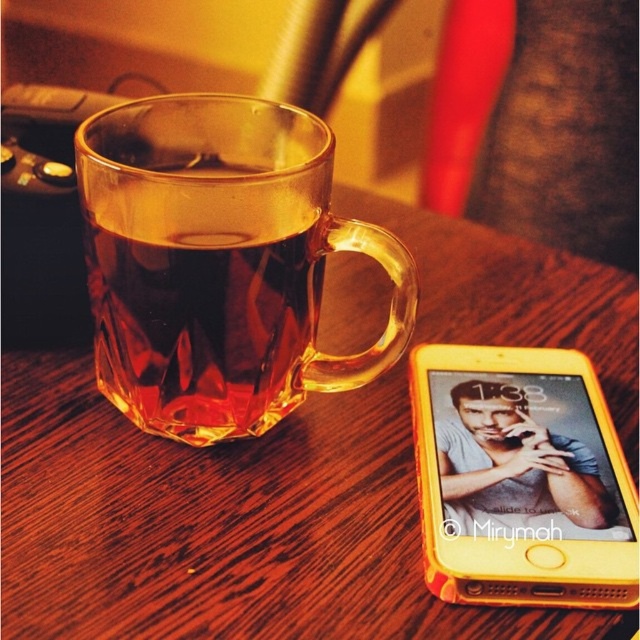
Question: Which point is closer to the camera taking this photo?

Choices:
 (A) (566, 426)
 (B) (150, 285)

Answer: (B)

Question: Which point is farther to the camera?

Choices:
 (A) (424, 352)
 (B) (179, 234)
 (C) (202, 608)

Answer: (A)

Question: Which point is closer to the camera taking this photo?

Choices:
 (A) (256, 284)
 (B) (506, 596)
 (C) (353, 419)

Answer: (B)

Question: Can you confirm if wooden table at center is thinner than transparent glass mug at left?

Choices:
 (A) no
 (B) yes

Answer: (A)

Question: Does wooden table at center appear on the right side of yellow plastic smartphone at right?

Choices:
 (A) no
 (B) yes

Answer: (A)

Question: Where is wooden table at center located in relation to transparent glass mug at left in the image?

Choices:
 (A) below
 (B) above

Answer: (A)